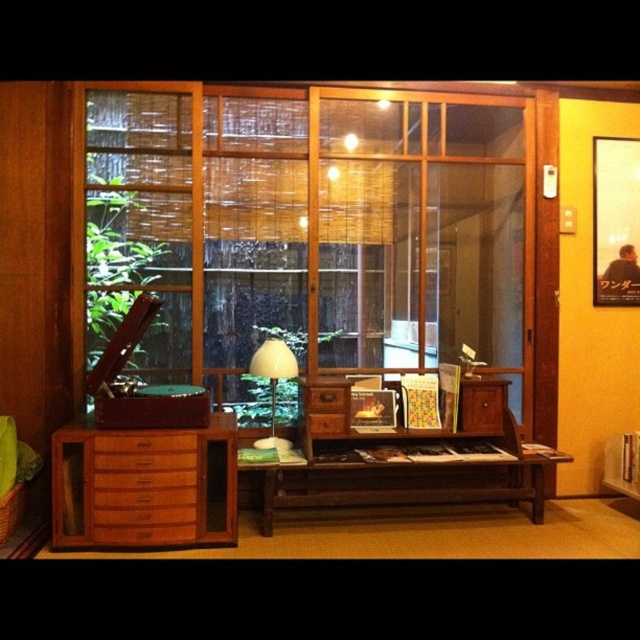
You are arranging a shelf and need to place the wooden frame at center and the white matte lamp at center. According to the scene, which object should be placed on the left side of the shelf?

The white matte lamp at center should be placed on the left side of the shelf because the wooden frame at center is to the right of it in the scene.

You are arranging a shelf in the living room and need to place the wooden frame at center and the white matte lamp at center. Given their positions, which object should be placed higher on the shelf?

The wooden frame at center should be placed higher on the shelf since it is positioned above the white matte lamp at center in the image.